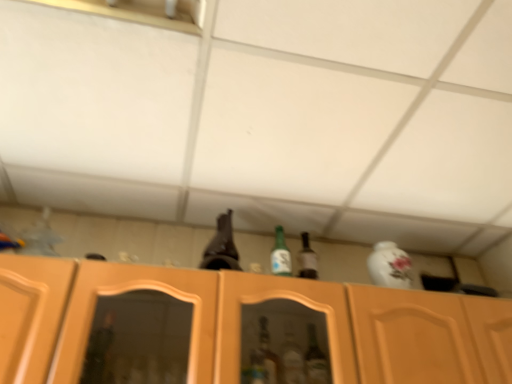
Question: Is green glass bottle at center spatially inside brown glass beer bottle at upper center, or outside of it?

Choices:
 (A) outside
 (B) inside

Answer: (A)

Question: From the image's perspective, relative to brown glass beer bottle at upper center, is green glass bottle at center above or below?

Choices:
 (A) below
 (B) above

Answer: (A)

Question: Which of these objects is positioned farthest from the green glass bottle at center?

Choices:
 (A) wooden cabinet at center
 (B) brown glass beer bottle at upper center

Answer: (A)

Question: Estimate the real-world distances between objects in this image. Which object is farther from the wooden cabinet at center?

Choices:
 (A) green glass bottle at center
 (B) brown glass beer bottle at upper center

Answer: (A)